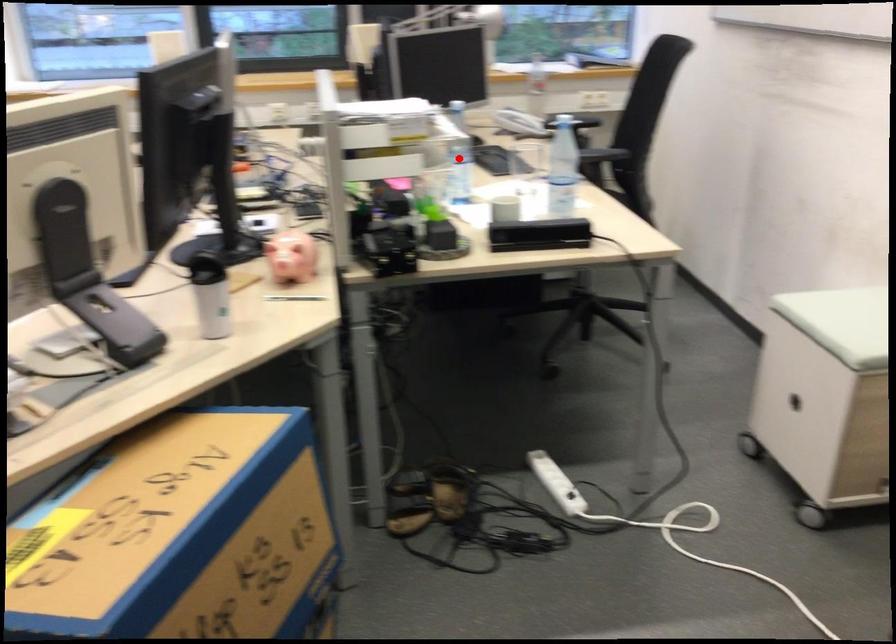
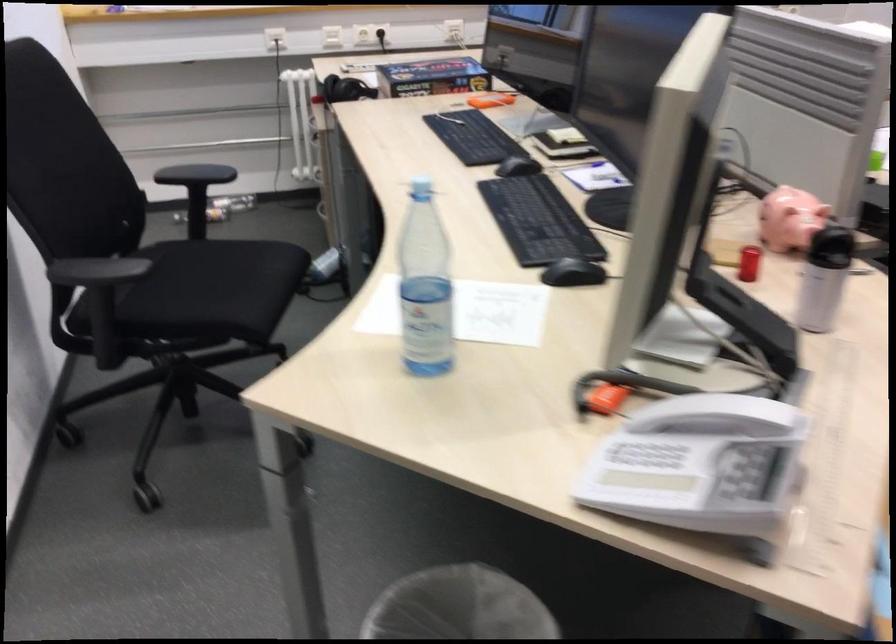
Question: I am providing you with two images of the same scene from different viewpoints. A red point is marked on the first image. At the location where the point appears in image 1, is it still visible in image 2?

Choices:
 (A) Yes
 (B) No

Answer: (B)